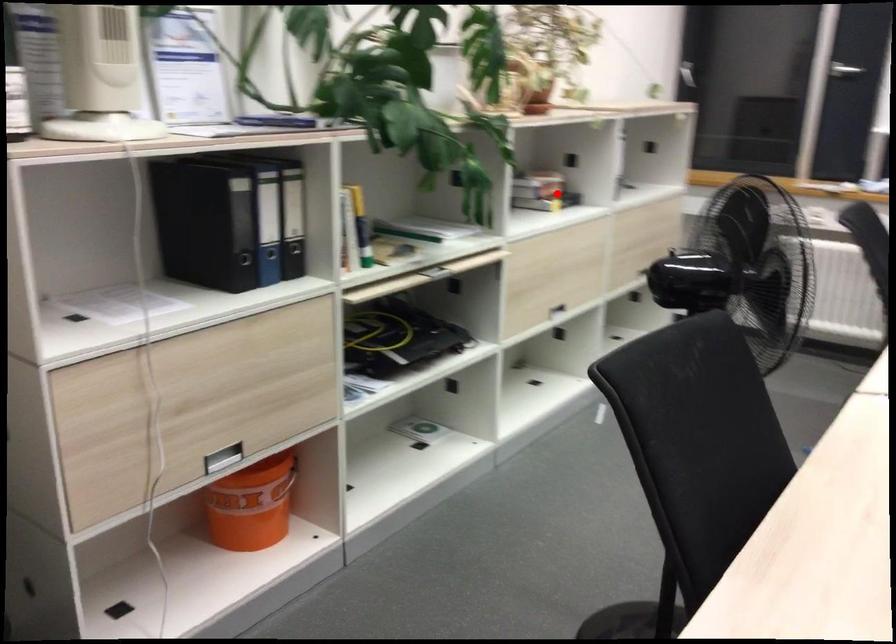
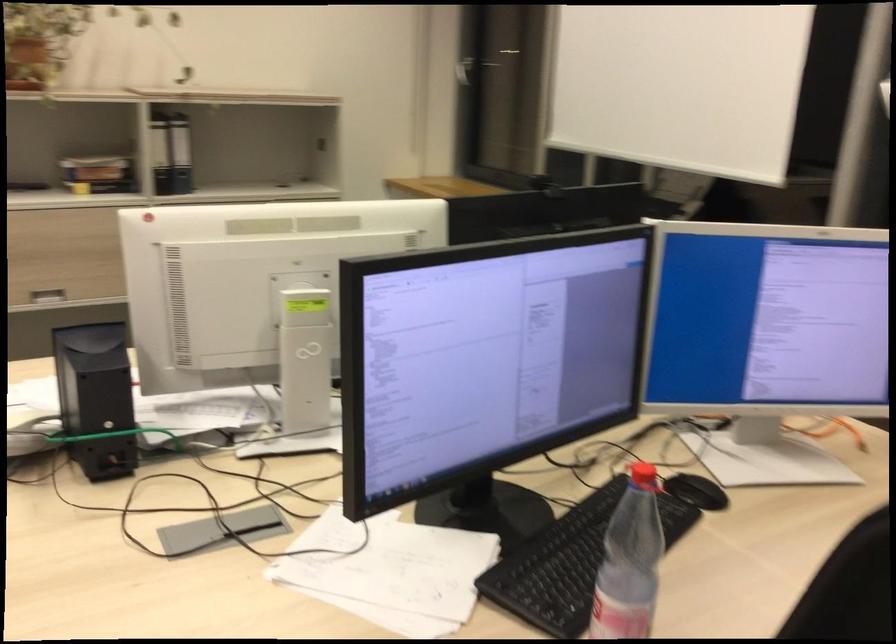
Where in the second image is the point corresponding to the highlighted location from the first image?

(105, 175)